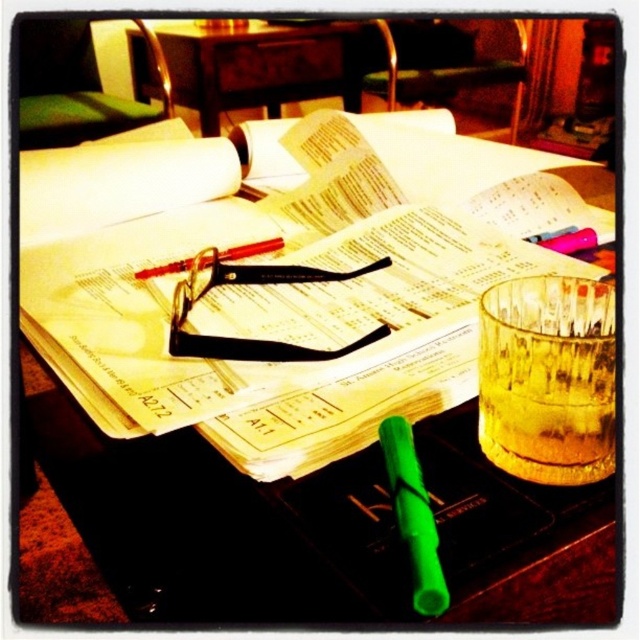
Does translucent glass cup at center have a smaller size compared to black plastic glasses at center?

Indeed, translucent glass cup at center has a smaller size compared to black plastic glasses at center.

Which is behind, point (522, 460) or point (342, 353)?

Point (342, 353)

At what (x,y) coordinates should I click in order to perform the action: click on translucent glass cup at center. Please return your answer as a coordinate pair (x, y). The image size is (640, 640). Looking at the image, I should click on point(547,378).

Can you confirm if translucent glass cup at center is smaller than green matte pencil at center?

Actually, translucent glass cup at center might be larger than green matte pencil at center.

Is point (561, 358) farther from viewer compared to point (388, 472)?

That is False.

Between point (493, 308) and point (429, 560), which one is positioned behind?

The point (493, 308) is behind.

Image resolution: width=640 pixels, height=640 pixels. Identify the location of translucent glass cup at center. (547, 378).

Does translucent glass cup at center have a lesser width compared to wooden table at center?

Indeed, translucent glass cup at center has a lesser width compared to wooden table at center.

Can you confirm if translucent glass cup at center is smaller than wooden table at center?

Yes, translucent glass cup at center is smaller than wooden table at center.

What do you see at coordinates (547, 378) in the screenshot? The height and width of the screenshot is (640, 640). I see `translucent glass cup at center` at bounding box center [547, 378].

At what (x,y) coordinates should I click in order to perform the action: click on translucent glass cup at center. Please return your answer as a coordinate pair (x, y). The width and height of the screenshot is (640, 640). Looking at the image, I should click on (547, 378).